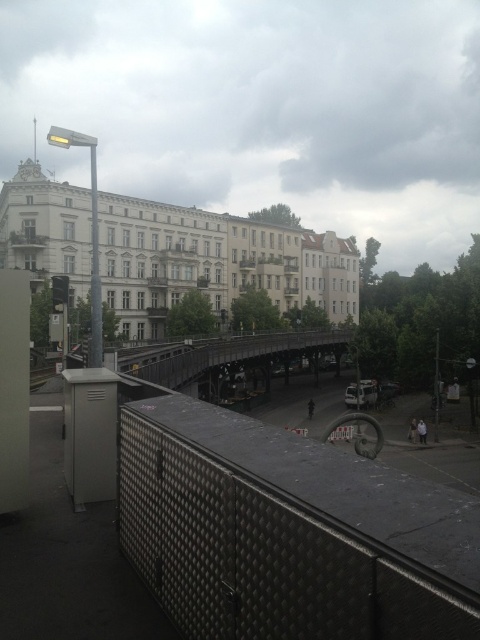
Can you confirm if white matte jacket at lower center is positioned above light brown leather jacket at lower right?

Yes.

Is point (421, 420) less distant than point (411, 420)?

Yes.

Locate an element on the screen. white matte jacket at lower center is located at coordinates (421, 432).

Is metallic gray bridge at center wider than light brown leather jacket at lower right?

Indeed, metallic gray bridge at center has a greater width compared to light brown leather jacket at lower right.

Which is in front, point (169, 356) or point (412, 426)?

Positioned in front is point (169, 356).

Locate an element on the screen. The height and width of the screenshot is (640, 480). metallic gray bridge at center is located at coordinates click(222, 353).

At what (x,y) coordinates should I click in order to perform the action: click on metallic gray bridge at center. Please return your answer as a coordinate pair (x, y). Looking at the image, I should click on (222, 353).

Which is behind, point (217, 356) or point (418, 422)?

Point (217, 356)

Is point (324, 342) farther from camera compared to point (422, 428)?

Yes.

Which is in front, point (120, 365) or point (419, 435)?

Point (120, 365) is more forward.

Find the location of a particular element. metallic gray bridge at center is located at coordinates click(222, 353).